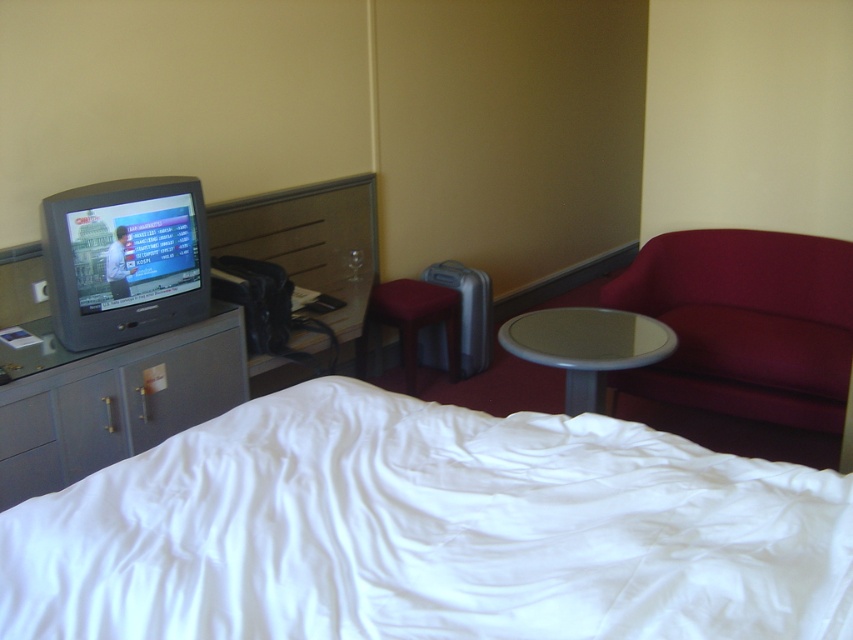
You are standing in a hotel room and see two points marked in the scene. The first point is at coordinate point (790, 353) and the second is at point (157, 353). Which point is closer to you?

Point (157, 353) is closer to you because it is positioned closer to the viewer than point (790, 353).